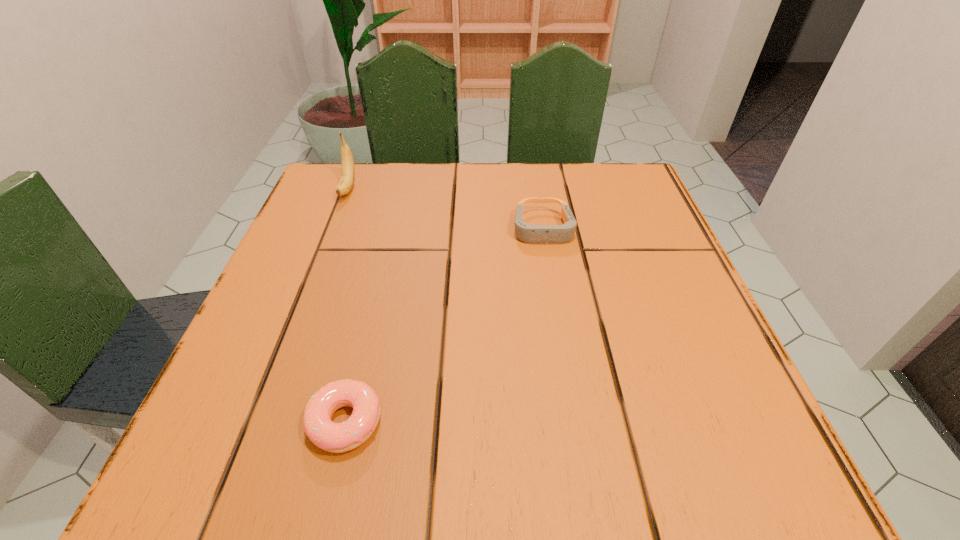
At what (x,y) coordinates should I click in order to perform the action: click on free space between the farthest object and the second object from left to right. Please return your answer as a coordinate pair (x, y). Image resolution: width=960 pixels, height=540 pixels. Looking at the image, I should click on (347, 305).

Where is `blank region between the doughnut and the goggles`? blank region between the doughnut and the goggles is located at coordinates (444, 325).

This screenshot has width=960, height=540. I want to click on object that ranks as the second closest to the doughnut, so click(345, 184).

Locate which object is the closest to the tallest object. Please provide its 2D coordinates. Your answer should be formatted as a tuple, i.e. [(x, y)], where the tuple contains the x and y coordinates of a point satisfying the conditions above.

[(536, 234)]

The width and height of the screenshot is (960, 540). I want to click on vacant area that satisfies the following two spatial constraints: 1. at the start of the peel on the tallest object; 2. on the left side of the second object from right to left, so click(257, 421).

You are a GUI agent. You are given a task and a screenshot of the screen. Output one action in this format:
    pyautogui.click(x=<x>, y=<y>)
    Task: Click on the free space in the image that satisfies the following two spatial constraints: 1. at the start of the peel on the nearest object; 2. on the left side of the banana
    The image size is (960, 540).
    Given the screenshot: What is the action you would take?
    pyautogui.click(x=257, y=421)